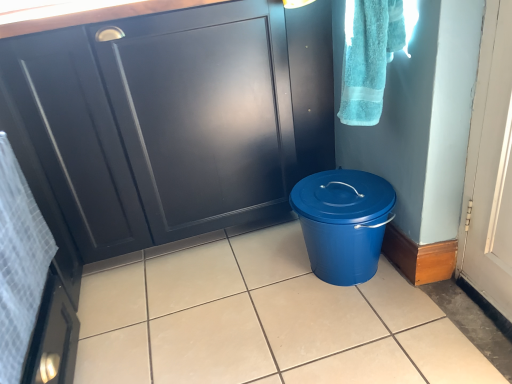
Where is `vacant area that lies between white textured towel at left, the second bath towel when ordered from top to bottom, and blue plastic bucket at lower right`? The image size is (512, 384). vacant area that lies between white textured towel at left, the second bath towel when ordered from top to bottom, and blue plastic bucket at lower right is located at coordinates (x=231, y=322).